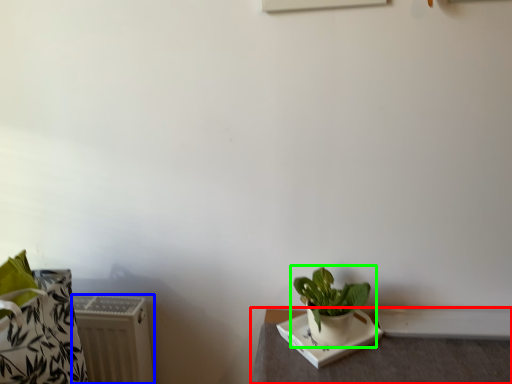
Question: Which is farther away from table (highlighted by a red box)? radiator (highlighted by a blue box) or houseplant (highlighted by a green box)?

Choices:
 (A) radiator
 (B) houseplant

Answer: (A)